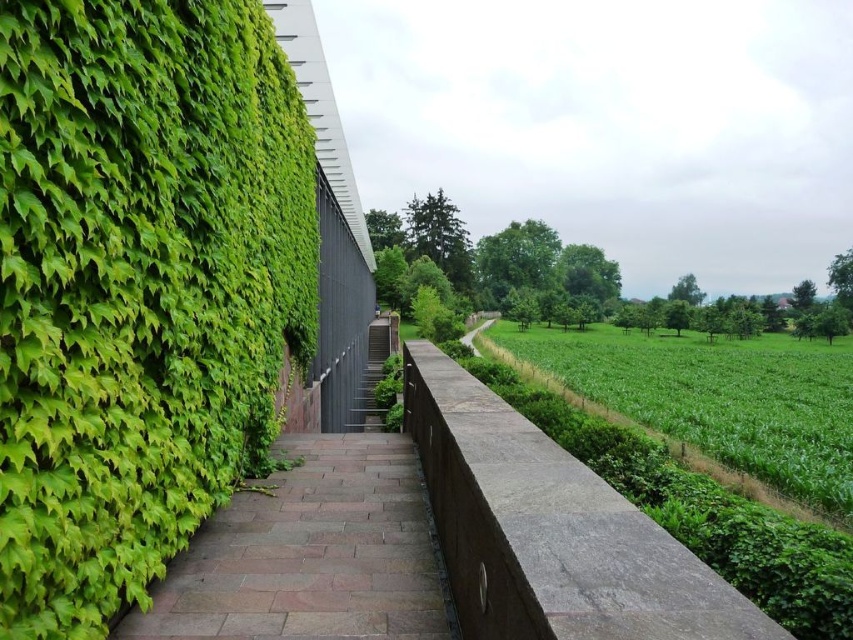
You are standing at the point closer to the camera between the two points, point (235,454) and point (293,586). Which point are you standing at?

You are standing at point (235,454) because it is further to the camera than point (293,586).

You are standing at the entrance of the pathway and want to locate the green leafy hedge at left. According to the coordinates provided, where should you look relative to your position?

The green leafy hedge at left is located at coordinates point (138, 288), which means it is positioned approximately 45.0 centimeters to the right and 16.3 centimeters above your eye level when standing at the entrance of the pathway.

You are a gardener who needs to water both the green leafy hedge at left and the brown stone path at center. Since the water hose is only 5 feet long, can you reach the hedge from the path without moving the hose?

The green leafy hedge at left is 4.99 feet away from brown stone path at center. Since the hose is 5 feet long, you can reach the hedge from the path without moving the hose.